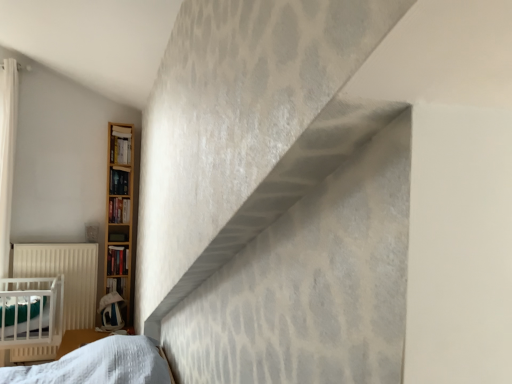
Question: Considering the positions of wooden bookshelf at left, the fifth book when ordered from bottom to top, and hardcover book at left, the 3th book from the top, in the image, is wooden bookshelf at left, the fifth book when ordered from bottom to top, taller or shorter than hardcover book at left, the 3th book from the top,?

Choices:
 (A) tall
 (B) short

Answer: (A)

Question: From the image's perspective, is wooden bookshelf at left, the fifth book when ordered from bottom to top, positioned above or below hardcover book at left, which ranks as the third book in bottom-to-top order?

Choices:
 (A) below
 (B) above

Answer: (B)

Question: Based on their relative distances, which object is farther from the hardcover book at left, which appears as the fourth book when viewed from the top?

Choices:
 (A) hardcover book at left, positioned as the first book in bottom-to-top order
 (B) hardcover book at left, which ranks as the third book in bottom-to-top order
 (C) white textured sheet at lower left
 (D) white matte radiator at left
 (E) matte black bookshelf at left, the 2th book viewed from the top

Answer: (C)

Question: Estimate the real-world distances between objects in this image. Which object is farther from the white matte radiator at left?

Choices:
 (A) matte black bookshelf at left, the 2th book viewed from the top
 (B) hardcover book at left, which ranks as the third book in bottom-to-top order
 (C) wooden bookshelf at left, the fifth book when ordered from bottom to top
 (D) white textured sheet at lower left
 (E) hardcover book at left, which appears as the second book when ordered from the bottom

Answer: (C)